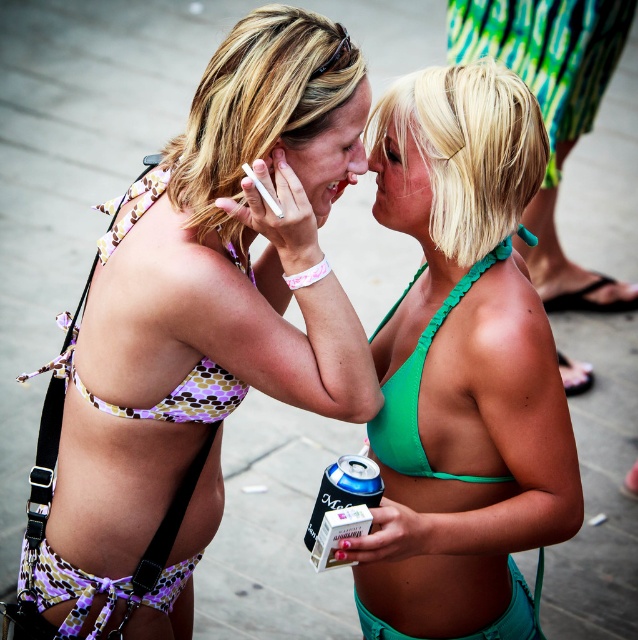
Question: Is matte green bikini at center positioned before printed fabric bikini bottoms at lower left?

Choices:
 (A) no
 (B) yes

Answer: (B)

Question: Considering the real-world distances, which object is closest to the matte purple bikini top at center?

Choices:
 (A) purple polka dot bikini top at upper left
 (B) green fabric bikini top at center
 (C) matte green bikini at center
 (D) green matte bikini top at center

Answer: (A)

Question: Which object is farther from the camera taking this photo?

Choices:
 (A) matte purple bikini top at center
 (B) matte green bikini at center
 (C) green fabric bikini top at center

Answer: (C)

Question: Is matte green bikini at center thinner than printed fabric bikini bottoms at lower left?

Choices:
 (A) yes
 (B) no

Answer: (A)

Question: Which point is farther from the camera taking this photo?

Choices:
 (A) (121, 580)
 (B) (410, 403)
 (C) (521, 132)
 (D) (130, 186)

Answer: (D)

Question: From the image, what is the correct spatial relationship of matte purple bikini top at center in relation to matte green bikini at center?

Choices:
 (A) right
 (B) left

Answer: (B)